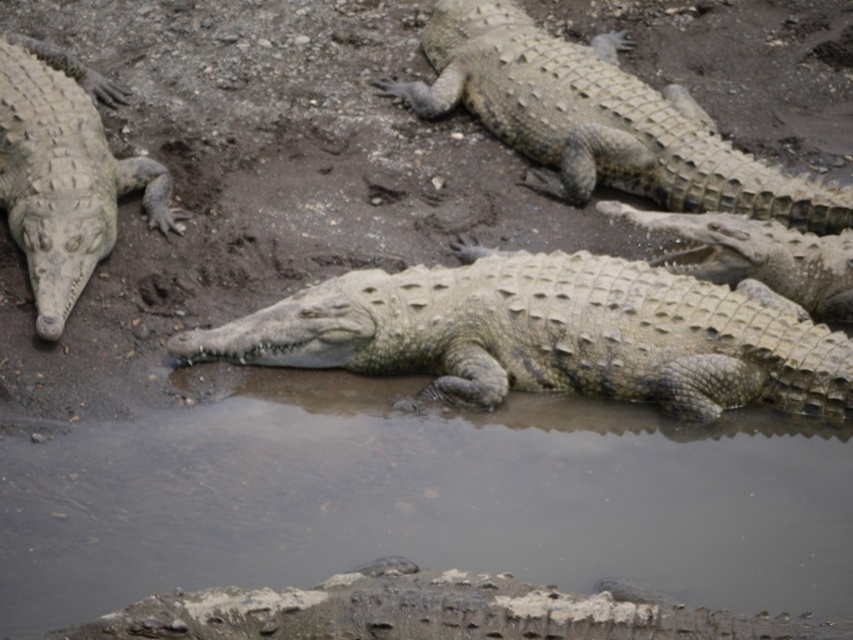
Question: Among these objects, which one is farthest from the camera?

Choices:
 (A) matte gray crocodile at left
 (B) translucent mud puddle at center
 (C) leathery scaly crocodile at upper right

Answer: (C)

Question: Among these objects, which one is nearest to the camera?

Choices:
 (A) leathery scaly crocodile at upper right
 (B) translucent mud puddle at center
 (C) sandy textured crocodile at center
 (D) leathery gray crocodile at lower center

Answer: (D)

Question: Can you confirm if translucent mud puddle at center is positioned to the right of leathery scaly crocodile at upper right?

Choices:
 (A) no
 (B) yes

Answer: (A)

Question: Can you confirm if translucent mud puddle at center is thinner than leathery gray crocodile at lower center?

Choices:
 (A) yes
 (B) no

Answer: (B)

Question: Which point is farther to the camera?

Choices:
 (A) (395, 344)
 (B) (753, 211)

Answer: (B)

Question: Can you confirm if leathery scaly crocodile at upper right is positioned above matte gray crocodile at left?

Choices:
 (A) yes
 (B) no

Answer: (A)